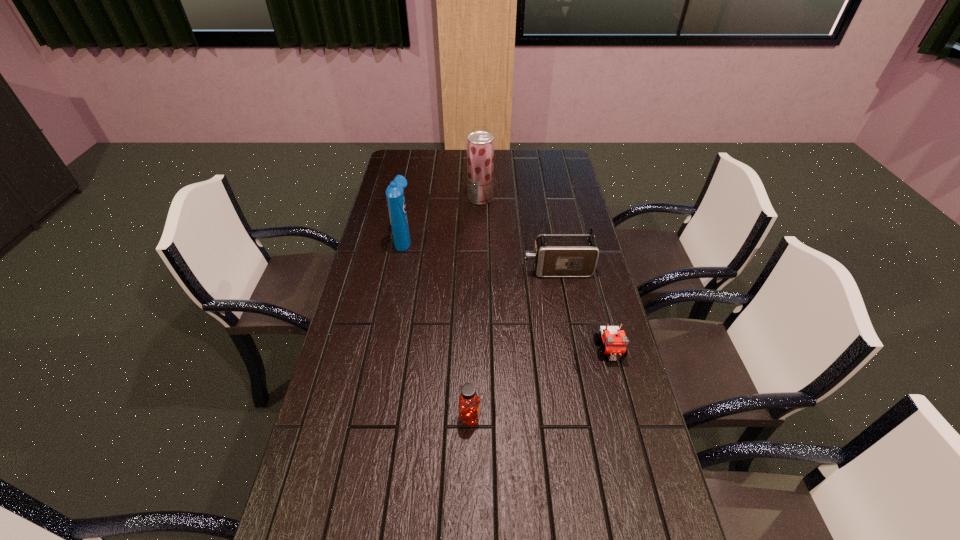
The height and width of the screenshot is (540, 960). I want to click on free region at the left edge, so click(304, 535).

In order to click on vacant space at the right edge of the desktop in this screenshot , I will do `click(586, 314)`.

In the image, there is a desktop. Where is `free region at the far left corner`? The width and height of the screenshot is (960, 540). free region at the far left corner is located at coordinates (393, 157).

I want to click on free spot between the camcorder and the farthest object, so click(519, 234).

This screenshot has width=960, height=540. I want to click on vacant area that lies between the nearest object and the shortest object, so [540, 383].

Where is `free area in between the fruit juice and the camcorder`? The image size is (960, 540). free area in between the fruit juice and the camcorder is located at coordinates (519, 234).

At what (x,y) coordinates should I click in order to perform the action: click on unoccupied position between the shampoo and the second shortest object. Please return your answer as a coordinate pair (x, y). The width and height of the screenshot is (960, 540). Looking at the image, I should click on (437, 328).

This screenshot has width=960, height=540. Find the location of `blank region between the nearest object and the fruit juice`. blank region between the nearest object and the fruit juice is located at coordinates (475, 308).

Locate an element on the screen. Image resolution: width=960 pixels, height=540 pixels. free space between the third nearest object and the fruit juice is located at coordinates (519, 234).

Identify the location of vacant region between the shampoo and the farthest object. (443, 219).